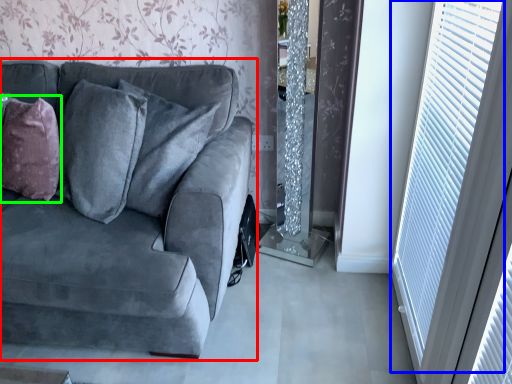
Question: Which is farther away from studio couch (highlighted by a red box)? window (highlighted by a blue box) or throw pillow (highlighted by a green box)?

Choices:
 (A) window
 (B) throw pillow

Answer: (A)